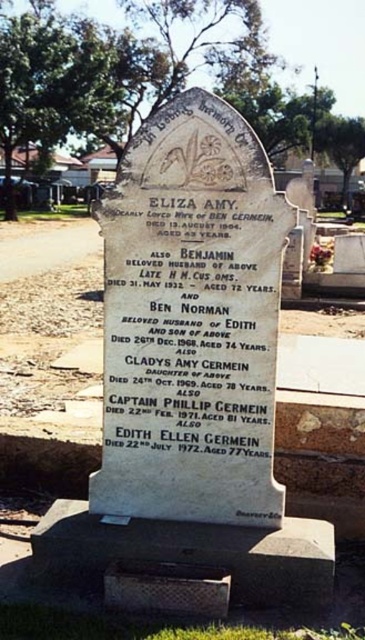
Question: From the image, what is the correct spatial relationship of white stone monument at center in relation to white stone plaque at center?

Choices:
 (A) below
 (B) above

Answer: (A)

Question: Which point is closer to the camera?

Choices:
 (A) white stone monument at center
 (B) white stone plaque at center

Answer: (A)

Question: Can you confirm if white stone monument at center is smaller than white stone plaque at center?

Choices:
 (A) yes
 (B) no

Answer: (B)

Question: Is white stone monument at center behind white stone plaque at center?

Choices:
 (A) yes
 (B) no

Answer: (B)

Question: Among these points, which one is nearest to the camera?

Choices:
 (A) (190, 308)
 (B) (183, 276)

Answer: (B)